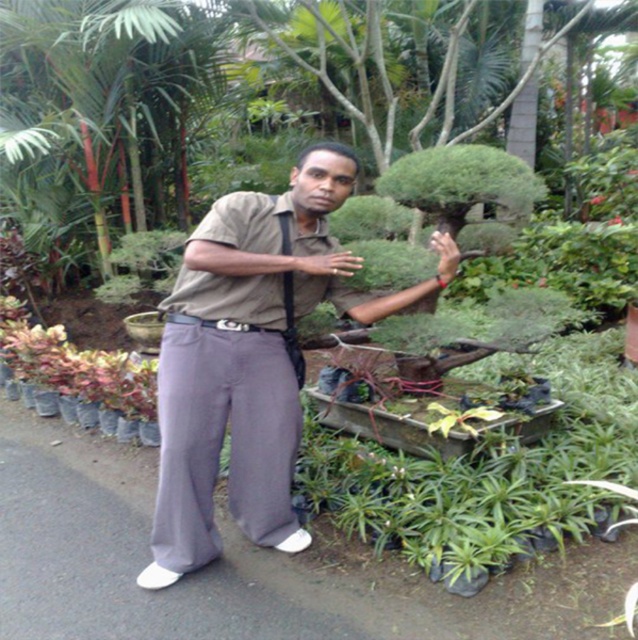
Question: Which object is closer to the camera taking this photo?

Choices:
 (A) matte khaki shirt at center
 (B) green matte flower at center
 (C) green matte leaf at center
 (D) green leafy plant at center

Answer: (A)

Question: Which point is closer to the camera taking this photo?

Choices:
 (A) (156, 154)
 (B) (588, 202)
 (C) (471, 147)
 (D) (537, 282)

Answer: (C)

Question: Does matte khaki shirt at center appear on the right side of green textured bonsai tree at upper right?

Choices:
 (A) no
 (B) yes

Answer: (A)

Question: Does green textured bonsai tree at upper right have a greater width compared to red matte flower at upper center?

Choices:
 (A) yes
 (B) no

Answer: (A)

Question: Which object is closer to the camera taking this photo?

Choices:
 (A) red matte flower at upper center
 (B) green matte bonsai tree at center

Answer: (B)

Question: Is matte khaki shirt at center below green textured bonsai tree at upper right?

Choices:
 (A) no
 (B) yes

Answer: (B)